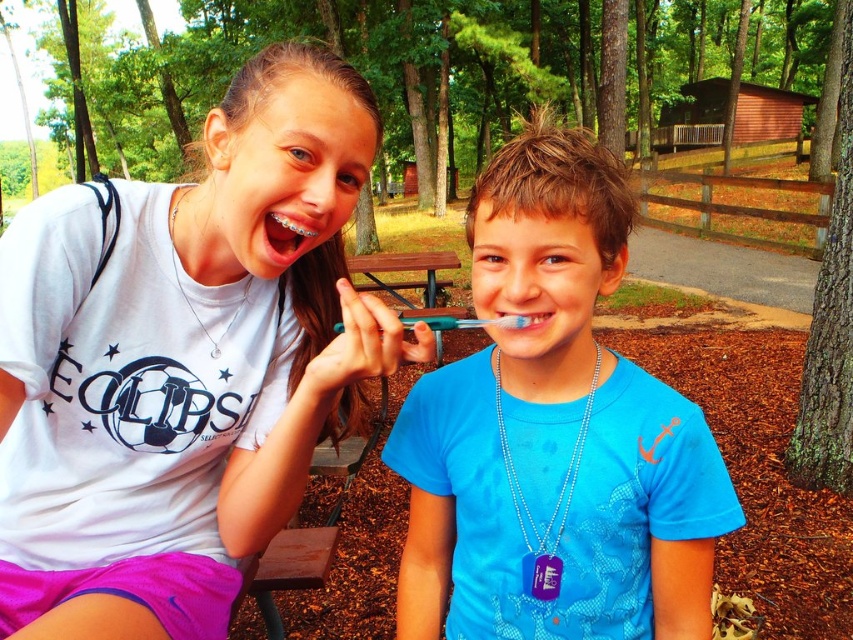
You are a dentist visiting a children park. You see the blue matte toothbrush at center. Can you pick it up to examine it? Explain why or why not based on its distance from you.

The blue matte toothbrush at center is 32.41 inches away from viewer, which is within a comfortable reaching distance. Therefore, you can easily pick it up to examine it.

You are a photographer trying to capture a candid shot of the two children in the park. You notice two specific points marked in the image. The first point is at coordinates point [45,632] and the second is at point [427,304]. Which of these points is closer to the camera?

Point [45,632] is in front of point [427,304], so it is closer to the camera.